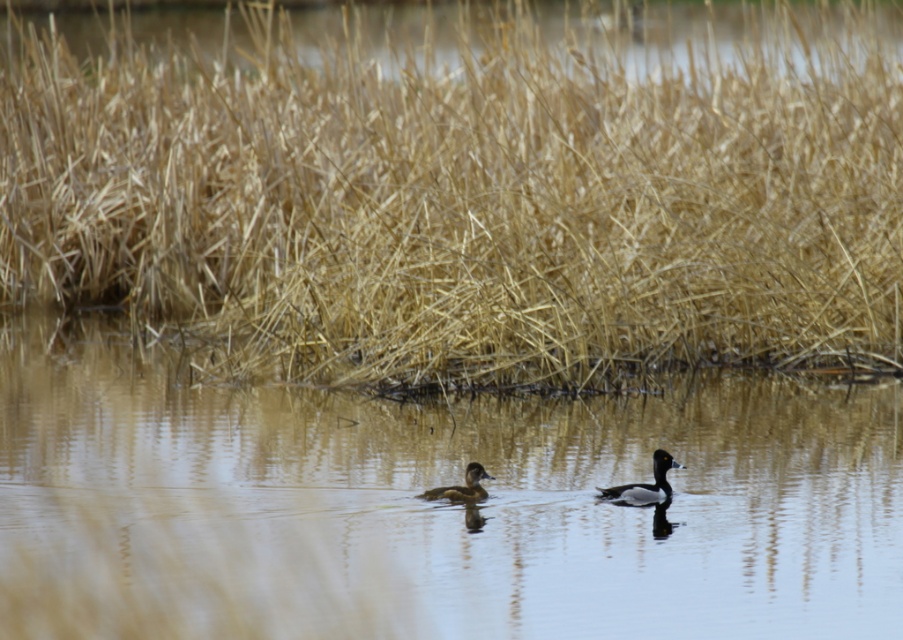
You are standing at the edge of the water and want to reach the clear water at center marked by point (433, 506). Which direction should you move to get there?

You should move towards the center of the water to reach the clear water at center marked by point (433, 506).

You are a birdwatcher observing the scene from the shore. You notice the brown glossy duck at center and the brown dry grass at upper center. Which object is closer to you, the observer?

The brown dry grass at upper center is closer to you because it is further to the viewer than the brown glossy duck at center.

You are a photographer aiming to capture a clear shot of the brown glossy duck at center without the brown dry grass at upper center blocking it. Based on their positions, is it possible to adjust your camera angle to achieve this?

The brown dry grass at upper center is positioned over the brown glossy duck at center, so adjusting the camera angle downward might allow you to capture the duck without the grass obstructing the view.